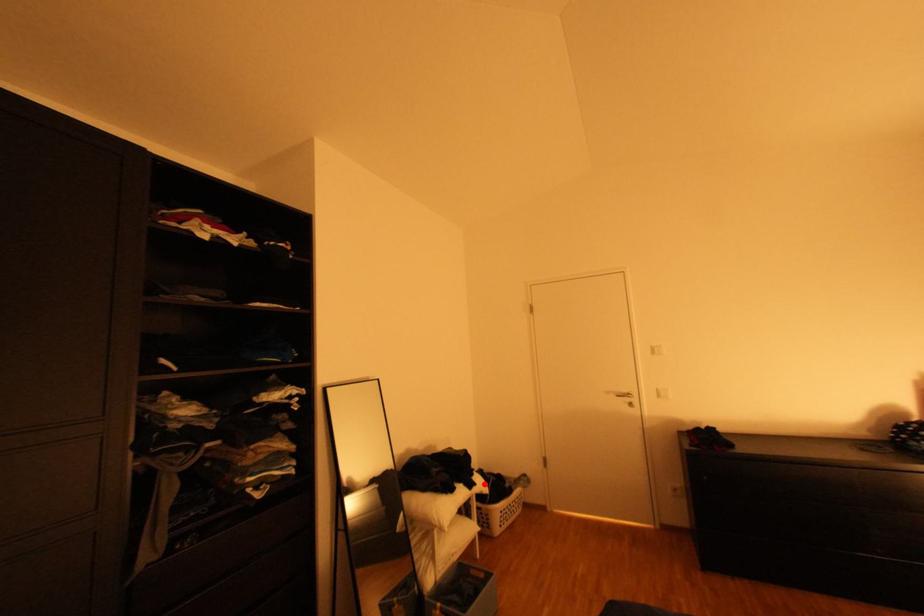
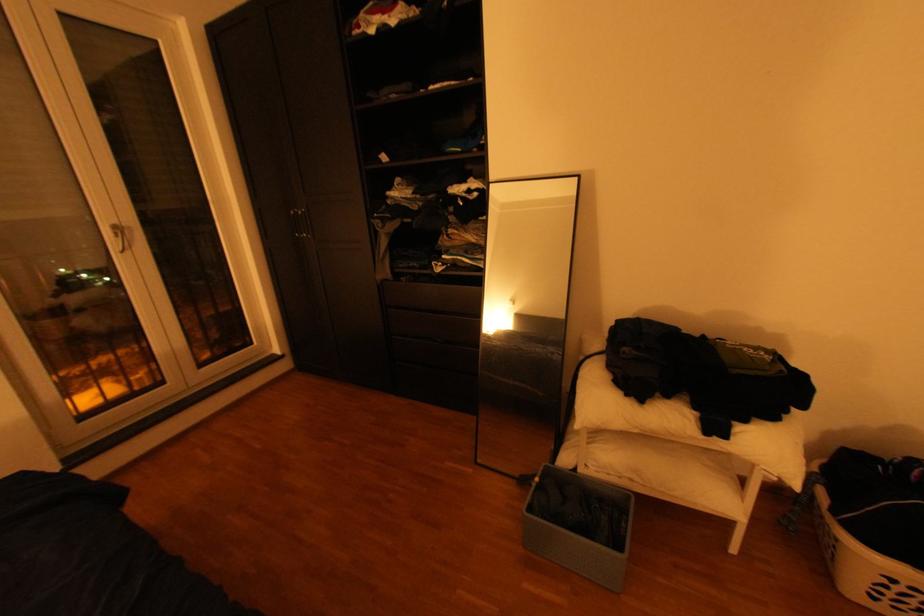
Locate, in the second image, the point that corresponds to the highlighted location in the first image.

(735, 436)